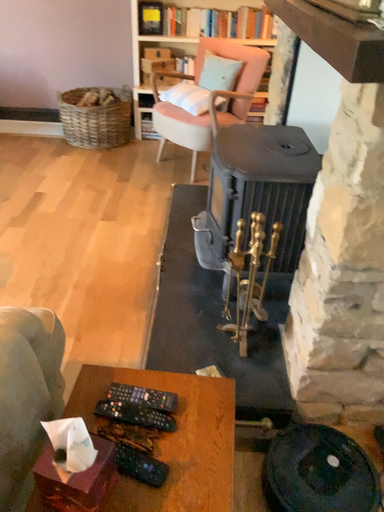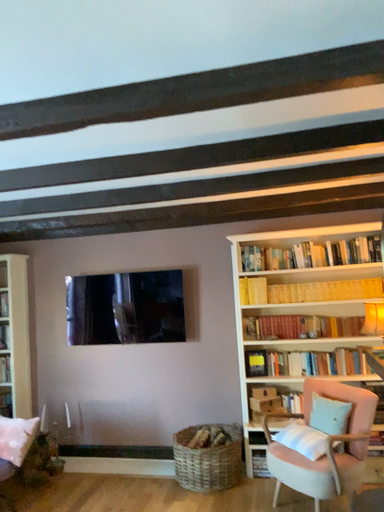
Question: Which way did the camera rotate in the video?

Choices:
 (A) rotated left
 (B) rotated right

Answer: (A)